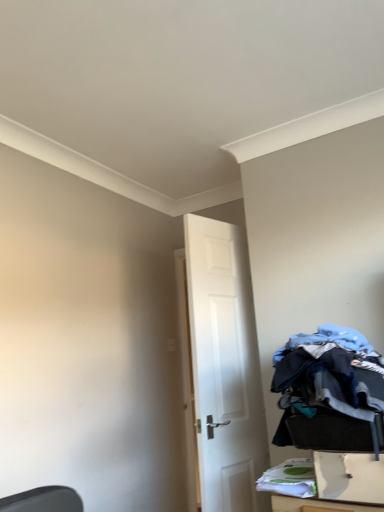
At what (x,y) coordinates should I click in order to perform the action: click on white matte door at center. Please return your answer as a coordinate pair (x, y). Image resolution: width=384 pixels, height=512 pixels. Looking at the image, I should click on (225, 367).

This screenshot has width=384, height=512. What do you see at coordinates (330, 392) in the screenshot?
I see `denim fabric laundry at lower right` at bounding box center [330, 392].

Image resolution: width=384 pixels, height=512 pixels. I want to click on white matte door at center, so click(225, 367).

Is denim fabric laundry at lower right positioned beyond the bounds of white matte door at center?

denim fabric laundry at lower right lies outside white matte door at center's area.

Which object is positioned more to the right, denim fabric laundry at lower right or white matte door at center?

From the viewer's perspective, denim fabric laundry at lower right appears more on the right side.

Between denim fabric laundry at lower right and white matte door at center, which one has smaller width?

white matte door at center.

Consider the image. Is white matte door at center thinner than denim fabric laundry at lower right?

Correct, the width of white matte door at center is less than that of denim fabric laundry at lower right.

Locate an element on the screen. The image size is (384, 512). laundry that appears on the right of white matte door at center is located at coordinates (330, 392).

Does white matte door at center have a larger size compared to denim fabric laundry at lower right?

Yes.

Relative to denim fabric laundry at lower right, is white matte door at center in front or behind?

Visually, white matte door at center is located behind denim fabric laundry at lower right.

Considering the relative positions of white plastic drawer at lower right and denim fabric laundry at lower right in the image provided, is white plastic drawer at lower right to the right of denim fabric laundry at lower right from the viewer's perspective?

Indeed, white plastic drawer at lower right is positioned on the right side of denim fabric laundry at lower right.

How many degrees apart are the facing directions of white plastic drawer at lower right and denim fabric laundry at lower right?

0.514 degrees separate the facing orientations of white plastic drawer at lower right and denim fabric laundry at lower right.

Are white plastic drawer at lower right and denim fabric laundry at lower right beside each other?

No.

In terms of height, does white plastic drawer at lower right look taller or shorter compared to denim fabric laundry at lower right?

Clearly, white plastic drawer at lower right is shorter compared to denim fabric laundry at lower right.

Is white plastic drawer at lower right facing towards white matte door at center?

No, white plastic drawer at lower right is not facing towards white matte door at center.

Would you consider white plastic drawer at lower right to be distant from white matte door at center?

No, white plastic drawer at lower right is not far away from white matte door at center.

Which point is more forward, (361, 501) or (258, 463)?

The point (361, 501) is closer to the camera.

Consider the image. From a real-world perspective, is denim fabric laundry at lower right physically above white plastic drawer at lower right?

Yes.

Is point (330, 394) closer or farther from the camera than point (377, 474)?

Point (330, 394).

Which object is wider, denim fabric laundry at lower right or white plastic drawer at lower right?

denim fabric laundry at lower right.

How much distance is there between white matte door at center and white plastic drawer at lower right?

white matte door at center is 32.16 inches away from white plastic drawer at lower right.

From the image's perspective, which is below, white matte door at center or white plastic drawer at lower right?

white plastic drawer at lower right is shown below in the image.

How many degrees apart are the facing directions of white matte door at center and white plastic drawer at lower right?

105 degrees.

Is white matte door at center wider than white plastic drawer at lower right?

In fact, white matte door at center might be narrower than white plastic drawer at lower right.

Where is `door below the denim fabric laundry at lower right (from the image's perspective)`? The image size is (384, 512). door below the denim fabric laundry at lower right (from the image's perspective) is located at coordinates (225, 367).

Where is `laundry in front of the white matte door at center`? The image size is (384, 512). laundry in front of the white matte door at center is located at coordinates (330, 392).

Which object lies further to the anchor point white matte door at center, white plastic drawer at lower right or denim fabric laundry at lower right?

white plastic drawer at lower right lies further to white matte door at center than the other object.

Estimate the real-world distances between objects in this image. Which object is further from denim fabric laundry at lower right, white plastic drawer at lower right or white matte door at center?

white matte door at center.

From the image, which object appears to be farther from white plastic drawer at lower right, denim fabric laundry at lower right or white matte door at center?

Based on the image, white matte door at center appears to be further to white plastic drawer at lower right.

Looking at this image, from the image, which object appears to be farther from white plastic drawer at lower right, white matte door at center or denim fabric laundry at lower right?

white matte door at center.

Which object lies nearer to the anchor point white matte door at center, denim fabric laundry at lower right or white plastic drawer at lower right?

denim fabric laundry at lower right.

Looking at the image, which one is located further to denim fabric laundry at lower right, white matte door at center or white plastic drawer at lower right?

white matte door at center lies further to denim fabric laundry at lower right than the other object.

I want to click on drawer between denim fabric laundry at lower right and white matte door at center in the front-back direction, so click(x=349, y=477).